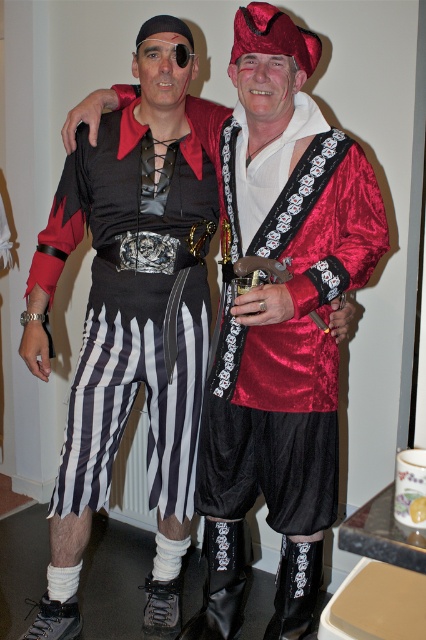
You are a costume designer trying to decide which costume piece to adjust first. Since the shiny red fabric vest at center and the black striped skirt at left are both part of the same ensemble, which one should you modify to ensure the overall length matches the other?

The shiny red fabric vest at center is shorter than the black striped skirt at left, so you should lengthen the shiny red fabric vest at center to match the length of the black striped skirt at left.

You are a costume designer trying to adjust the layers of the shiny red fabric vest at center and the black striped skirt at left. Which item is currently covering the other?

The shiny red fabric vest at center is positioned over the black striped skirt at left, so the vest is covering the skirt.

You are a photographer setting up for a pirate costume photoshoot. You need to position the shiny red fabric vest at center and the black striped skirt at left in a way that they are aligned horizontally. Based on their current positions, which object should you move to the left to achieve this alignment?

The shiny red fabric vest at center is currently to the right of the black striped skirt at left. To align them horizontally, you should move the shiny red fabric vest at center to the left until it is positioned directly next to or in line with the black striped skirt at left.